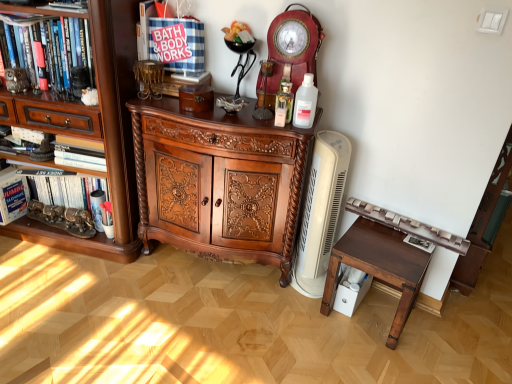
The height and width of the screenshot is (384, 512). Find the location of `free location above dark brown wooden table at right (from a real-world perspective)`. free location above dark brown wooden table at right (from a real-world perspective) is located at coordinates (391, 246).